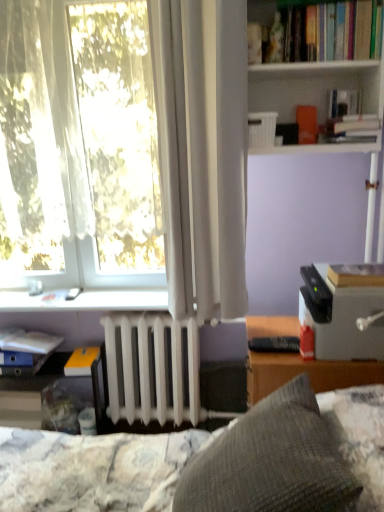
Question: Based on their sizes in the image, would you say white matte radiator at center is bigger or smaller than matte blue book at lower left, placed as the 4th book when sorted from front to back?

Choices:
 (A) big
 (B) small

Answer: (A)

Question: Is point (160, 315) positioned closer to the camera than point (16, 339)?

Choices:
 (A) closer
 (B) farther

Answer: (A)

Question: Which object is the farthest from the hardcover book at upper right, the fourth book in the back-to-front sequence?

Choices:
 (A) white plastic shelf at upper center, the 1th shelf viewed from the top
 (B) black plastic printer at right
 (C) black plastic remote control at lower center
 (D) matte blue book at lower left, positioned as the 2th book in back-to-front order
 (E) hardcover book at right, which appears as the 3th book when ordered from the bottom

Answer: (D)

Question: Which object is the farthest from the black plastic printer at right?

Choices:
 (A) gray textured pillow at center
 (B) yellow matte book at lower left, which appears as the 4th book when viewed from the right
 (C) black plastic remote control at lower center
 (D) hardcover book at right, the 1th book from the front
 (E) hardcover book at upper right, the third book viewed from the right

Answer: (B)